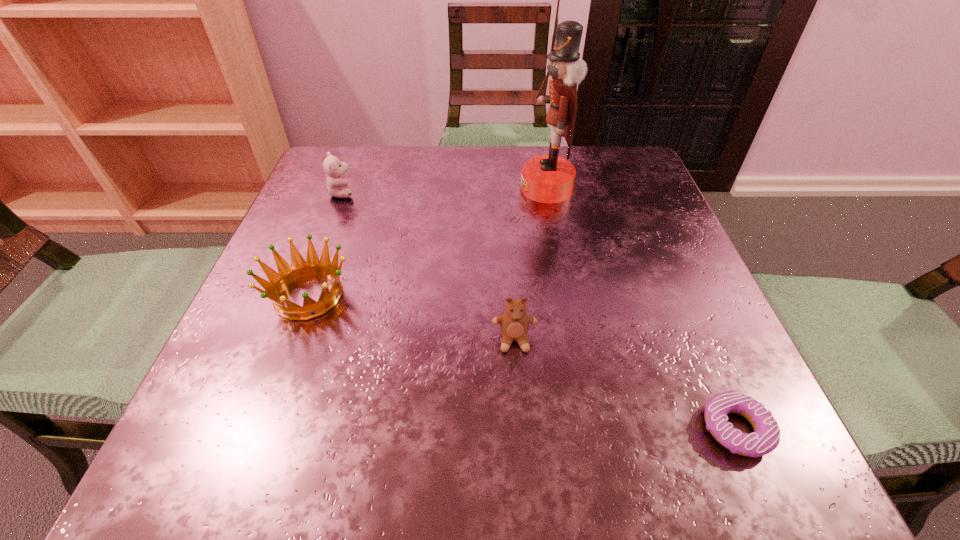
Identify the location of blank area in the image that satisfies the following two spatial constraints: 1. on the front-facing side of the nutcracker; 2. on the front-facing side of the nearer teddy bear. (575, 340).

Identify the location of vacant area in the image that satisfies the following two spatial constraints: 1. on the back side of the crown; 2. at the face of the farther teddy bear. pyautogui.click(x=347, y=193).

Where is `free space that satisfies the following two spatial constraints: 1. on the front-facing side of the third object from left to right; 2. on the left side of the nearest object`? This screenshot has width=960, height=540. free space that satisfies the following two spatial constraints: 1. on the front-facing side of the third object from left to right; 2. on the left side of the nearest object is located at coordinates (520, 428).

Where is `vacant space that satisfies the following two spatial constraints: 1. on the front-facing side of the nutcracker; 2. on the front side of the crown`? The height and width of the screenshot is (540, 960). vacant space that satisfies the following two spatial constraints: 1. on the front-facing side of the nutcracker; 2. on the front side of the crown is located at coordinates (567, 295).

Locate an element on the screen. This screenshot has height=540, width=960. free point that satisfies the following two spatial constraints: 1. at the face of the left teddy bear; 2. on the back side of the crown is located at coordinates (302, 295).

Identify the location of free location that satisfies the following two spatial constraints: 1. on the front-facing side of the second object from right to left; 2. on the front side of the crown. The height and width of the screenshot is (540, 960). (567, 295).

The height and width of the screenshot is (540, 960). What are the coordinates of `free spot that satisfies the following two spatial constraints: 1. on the front-facing side of the rightmost object; 2. on the right side of the right teddy bear` in the screenshot? It's located at (520, 428).

Locate an element on the screen. This screenshot has width=960, height=540. free region that satisfies the following two spatial constraints: 1. at the face of the shortest object; 2. on the left side of the left teddy bear is located at coordinates (251, 428).